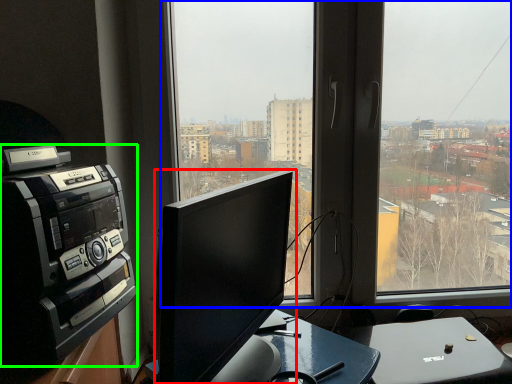
Question: Based on their relative distances, which object is farther from computer monitor (highlighted by a red box)? Choose from window (highlighted by a blue box) and amplifier (highlighted by a green box).

Choices:
 (A) window
 (B) amplifier

Answer: (A)